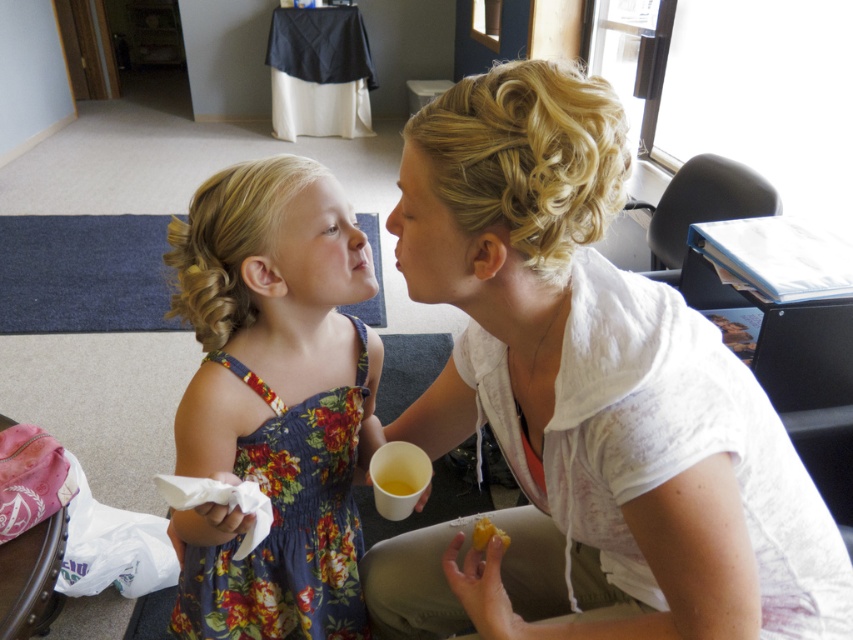
Is white cotton shirt at upper right positioned in front of floral fabric dress at center?

That is True.

Which is in front, point (521, 209) or point (264, 468)?

Point (521, 209) is in front.

Identify the location of white cotton shirt at upper right. (585, 400).

Between floral fabric dress at center and yellow matte food at lower center, which one is positioned lower?

yellow matte food at lower center is below.

Does floral fabric dress at center come behind yellow matte food at lower center?

No, floral fabric dress at center is closer to the viewer.

At what (x,y) coordinates should I click in order to perform the action: click on floral fabric dress at center. Please return your answer as a coordinate pair (x, y). Looking at the image, I should click on (273, 401).

You are a GUI agent. You are given a task and a screenshot of the screen. Output one action in this format:
    pyautogui.click(x=<x>, y=<y>)
    Task: Click on the white cotton shirt at upper right
    Image resolution: width=853 pixels, height=640 pixels.
    Given the screenshot: What is the action you would take?
    pyautogui.click(x=585, y=400)

Which is behind, point (579, 168) or point (480, 540)?

The point (480, 540) is more distant.

The width and height of the screenshot is (853, 640). I want to click on white cotton shirt at upper right, so click(x=585, y=400).